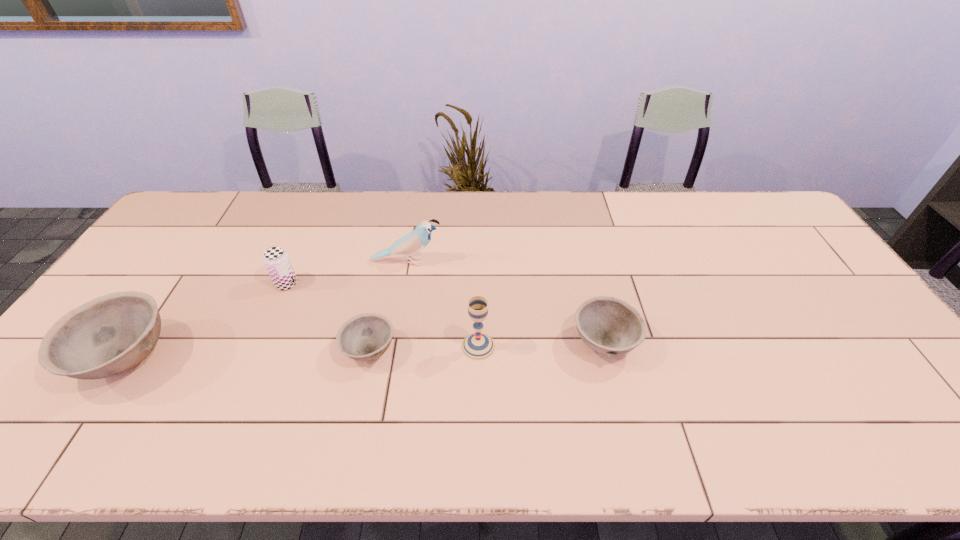
In the current image, all bowls are evenly spaced. To maintain this equal spacing, where should an additional bowl be placed on the right? Please point out a free spot. Please provide its 2D coordinates. Your answer should be formatted as a tuple, i.e. [(x, y)], where the tuple contains the x and y coordinates of a point satisfying the conditions above.

[(832, 335)]